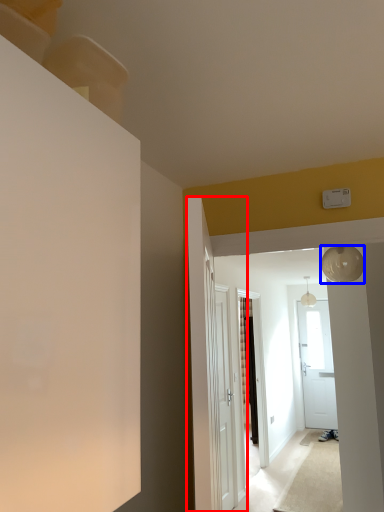
Question: Which of the following is the farthest to the observer, door (highlighted by a red box) or lamp (highlighted by a blue box)?

Choices:
 (A) door
 (B) lamp

Answer: (B)